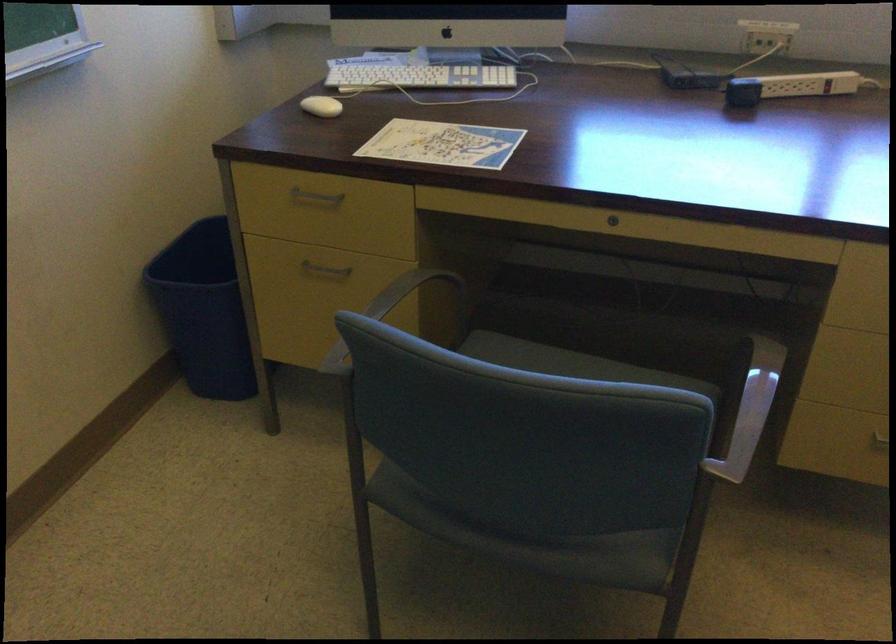
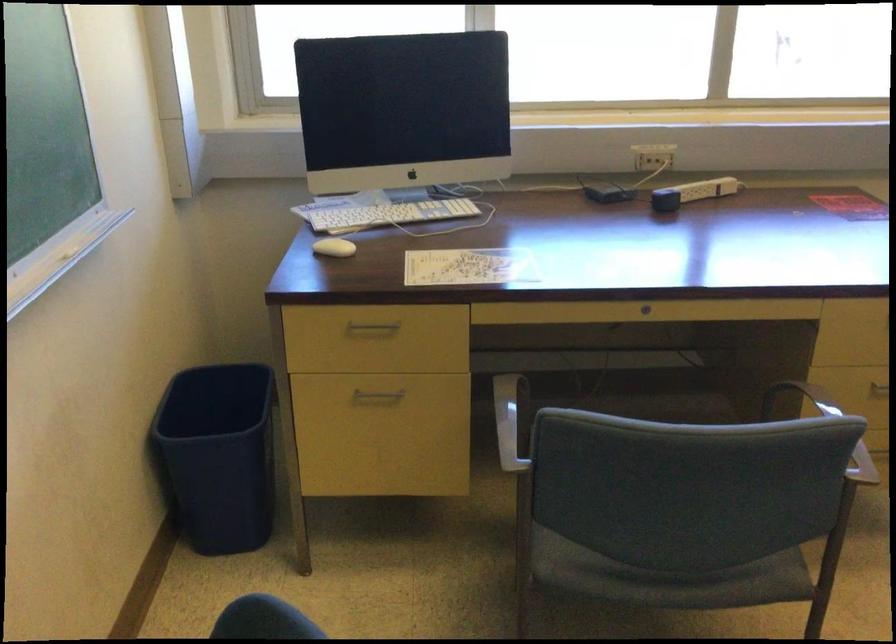
The point at (316, 199) is marked in the first image. Where is the corresponding point in the second image?

(373, 327)